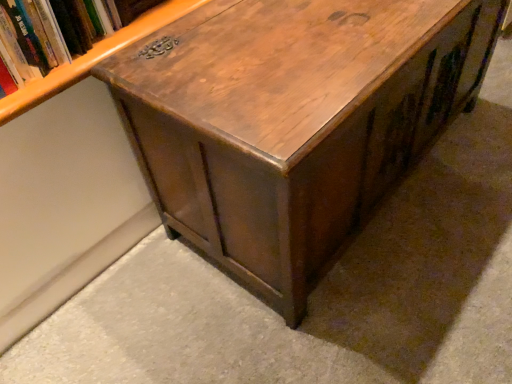
Question: From a real-world perspective, is wooden bookshelf at upper left above or below shiny brown wood table at center?

Choices:
 (A) below
 (B) above

Answer: (B)

Question: Would you say wooden bookshelf at upper left is to the left or to the right of shiny brown wood table at center in the picture?

Choices:
 (A) left
 (B) right

Answer: (A)

Question: Is point (36, 21) positioned closer to the camera than point (225, 87)?

Choices:
 (A) farther
 (B) closer

Answer: (A)

Question: Looking at their shapes, would you say shiny brown wood table at center is wider or thinner than wooden bookshelf at upper left?

Choices:
 (A) thin
 (B) wide

Answer: (B)

Question: In terms of size, does shiny brown wood table at center appear bigger or smaller than wooden bookshelf at upper left?

Choices:
 (A) small
 (B) big

Answer: (B)

Question: Based on their positions, is shiny brown wood table at center located to the left or right of wooden bookshelf at upper left?

Choices:
 (A) right
 (B) left

Answer: (A)

Question: From a real-world perspective, is shiny brown wood table at center positioned above or below wooden bookshelf at upper left?

Choices:
 (A) above
 (B) below

Answer: (B)